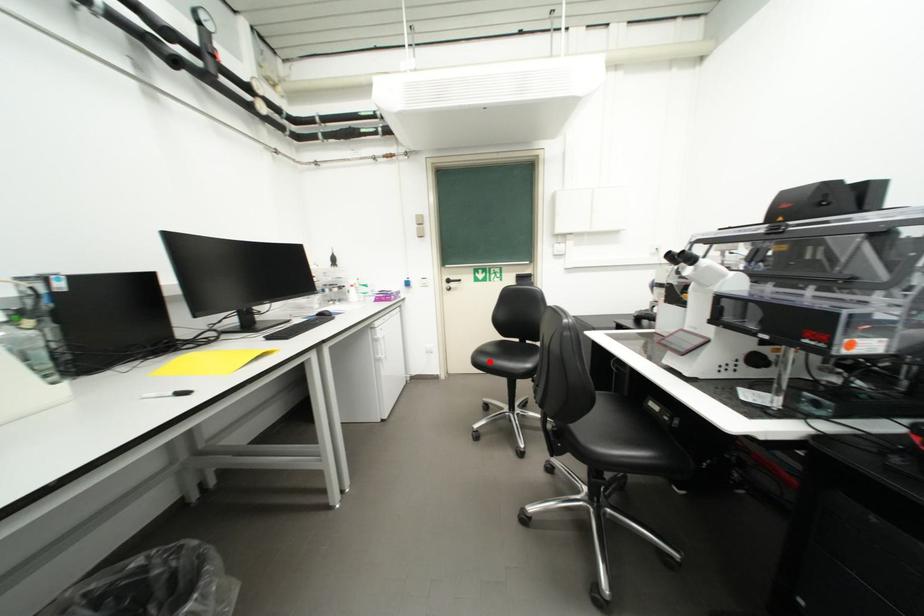
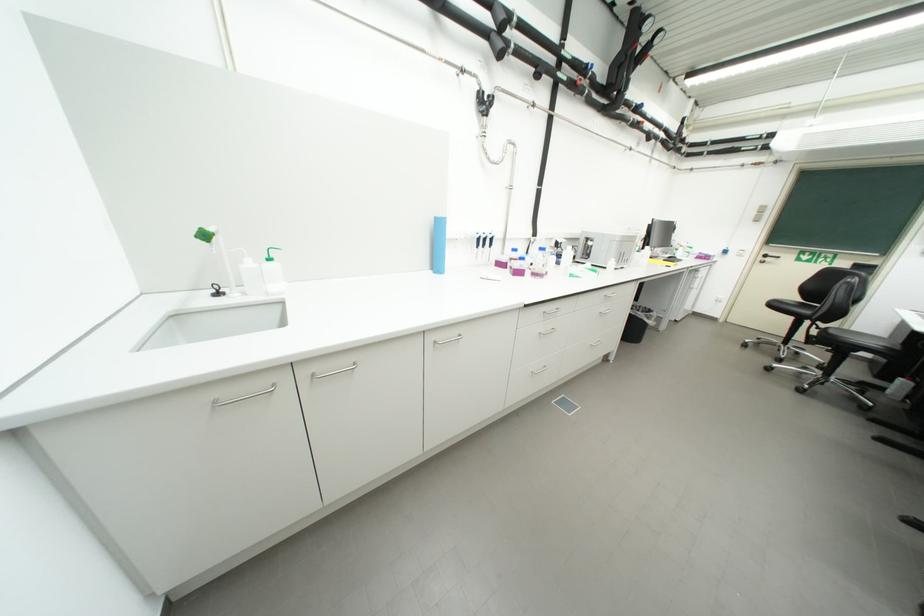
Locate, in the second image, the point that corresponds to the highlighted location in the first image.

(783, 307)